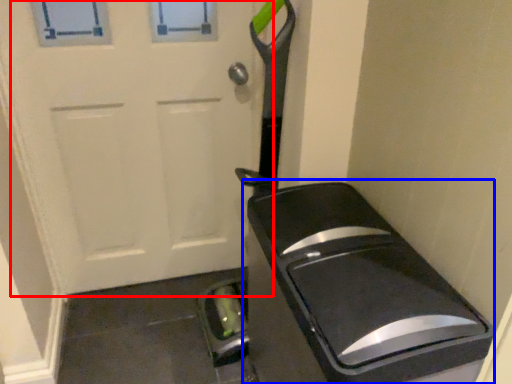
Question: Among these objects, which one is farthest to the camera, door (highlighted by a red box) or appliance (highlighted by a blue box)?

Choices:
 (A) door
 (B) appliance

Answer: (A)